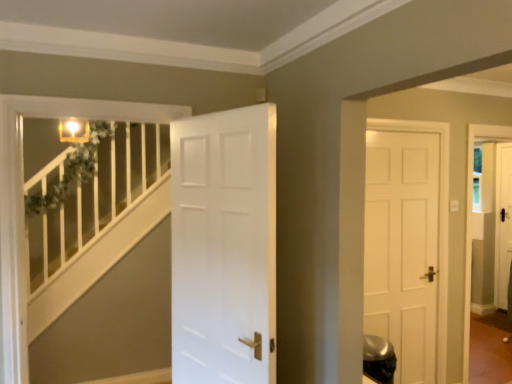
Question: Considering the relative positions of white painted wood balustrade at left and white matte door at center in the image provided, is white painted wood balustrade at left to the right of white matte door at center from the viewer's perspective?

Choices:
 (A) no
 (B) yes

Answer: (A)

Question: Is white painted wood balustrade at left in contact with white matte door at center?

Choices:
 (A) yes
 (B) no

Answer: (B)

Question: From the image's perspective, is white painted wood balustrade at left beneath white matte door at center?

Choices:
 (A) no
 (B) yes

Answer: (B)

Question: Could you tell me if white painted wood balustrade at left is facing white matte door at center?

Choices:
 (A) yes
 (B) no

Answer: (B)

Question: From a real-world perspective, is white painted wood balustrade at left below white matte door at center?

Choices:
 (A) no
 (B) yes

Answer: (B)

Question: Is the position of white painted wood balustrade at left less distant than that of white matte door at center?

Choices:
 (A) yes
 (B) no

Answer: (B)

Question: Is white painted wood balustrade at left at the back of white matte door at center?

Choices:
 (A) yes
 (B) no

Answer: (B)

Question: Does white matte door at center have a smaller size compared to white painted wood balustrade at left?

Choices:
 (A) no
 (B) yes

Answer: (A)

Question: Considering the relative positions of white matte door at center and white painted wood balustrade at left in the image provided, is white matte door at center behind white painted wood balustrade at left?

Choices:
 (A) yes
 (B) no

Answer: (B)

Question: Is white matte door at center at the left side of white painted wood balustrade at left?

Choices:
 (A) yes
 (B) no

Answer: (B)

Question: Does white matte door at center come in front of white painted wood balustrade at left?

Choices:
 (A) no
 (B) yes

Answer: (B)

Question: Is white matte door at center thinner than white painted wood balustrade at left?

Choices:
 (A) no
 (B) yes

Answer: (B)

Question: Considering the positions of white matte door at center and white painted wood balustrade at left in the image, is white matte door at center bigger or smaller than white painted wood balustrade at left?

Choices:
 (A) big
 (B) small

Answer: (A)